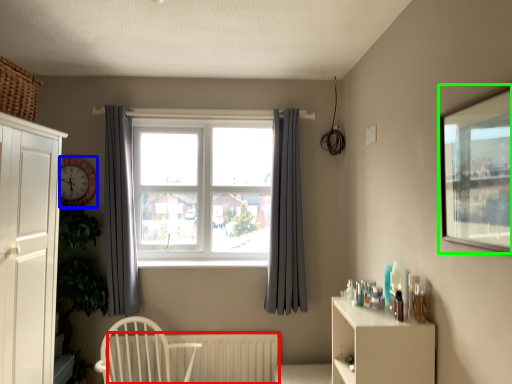
Question: Estimate the real-world distances between objects in this image. Which object is farther from radiator (highlighted by a red box), clock (highlighted by a blue box) or window screen (highlighted by a green box)?

Choices:
 (A) clock
 (B) window screen

Answer: (B)